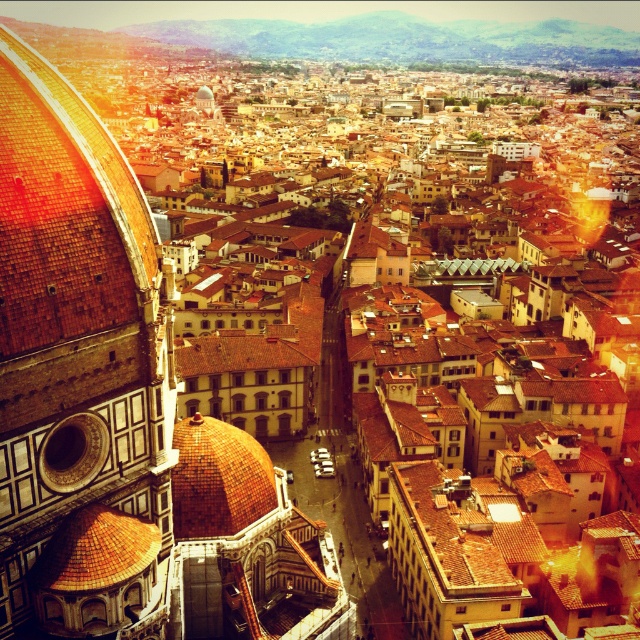
Question: Where is brown tiled dome at left located in relation to brown tiled dome at center-left in the image?

Choices:
 (A) above
 (B) below

Answer: (A)

Question: Does golden mosaic dome at center appear over brown tiled dome at center-left?

Choices:
 (A) no
 (B) yes

Answer: (B)

Question: Estimate the real-world distances between objects in this image. Which object is closer to the golden mosaic dome at center?

Choices:
 (A) brown tiled dome at left
 (B) brown tiled dome at center-left

Answer: (B)

Question: Among these points, which one is nearest to the camera?

Choices:
 (A) (100, 576)
 (B) (179, 508)
 (C) (36, 164)

Answer: (C)

Question: Can you confirm if brown tiled dome at left is wider than golden mosaic dome at center?

Choices:
 (A) no
 (B) yes

Answer: (B)

Question: Which of the following is the closest to the observer?

Choices:
 (A) brown tiled dome at left
 (B) brown tiled dome at center-left

Answer: (A)